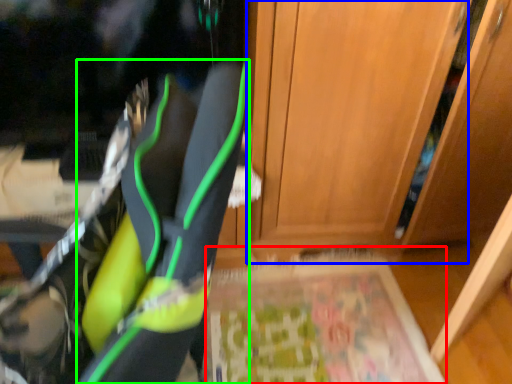
Question: Which object is the farthest from yoga mat (highlighted by a red box)? Choose among these: door (highlighted by a blue box) or footwear (highlighted by a green box).

Choices:
 (A) door
 (B) footwear

Answer: (B)